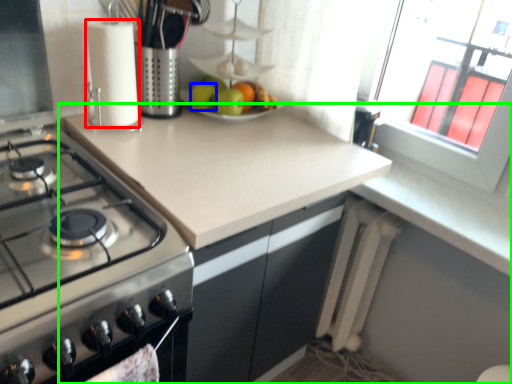
Question: Which object is positioned farthest from kitchen appliance (highlighted by a red box)? Select from apple (highlighted by a blue box) and countertop (highlighted by a green box).

Choices:
 (A) apple
 (B) countertop

Answer: (B)